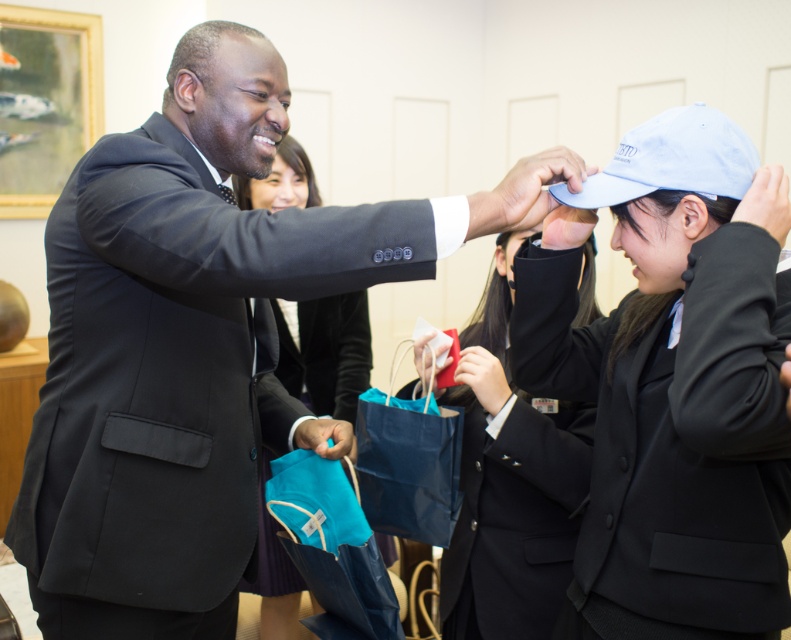
You are organizing a formal event and need to ensure that all accessories comply with the dress code. The dress code states that no accessory wider than 10 cm is allowed. You have the light blue fabric baseball cap at upper right and the black satin tie at upper center. Which accessory might violate the dress code?

The light blue fabric baseball cap at upper right might violate the dress code since it is wider than the black satin tie at upper center, and if the tie is under 10 cm, the cap could exceed the 10 cm width limit.

You are an event planner observing the scene. You need to arrange a photo shoot where the matte black blazer at center and the black satin tie at upper center must be visible. Which object should be positioned to the left to ensure both are in frame?

The black satin tie at upper center should be positioned to the left of the matte black blazer at center because the matte black blazer at center is currently to the right of the black satin tie at upper center.